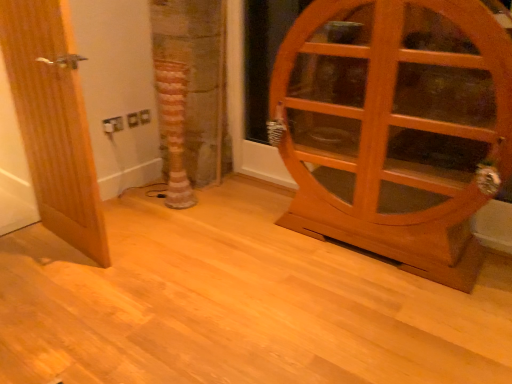
Where is `space that is in front of wooden door at left, the 2th door from the right`? space that is in front of wooden door at left, the 2th door from the right is located at coordinates coord(59,289).